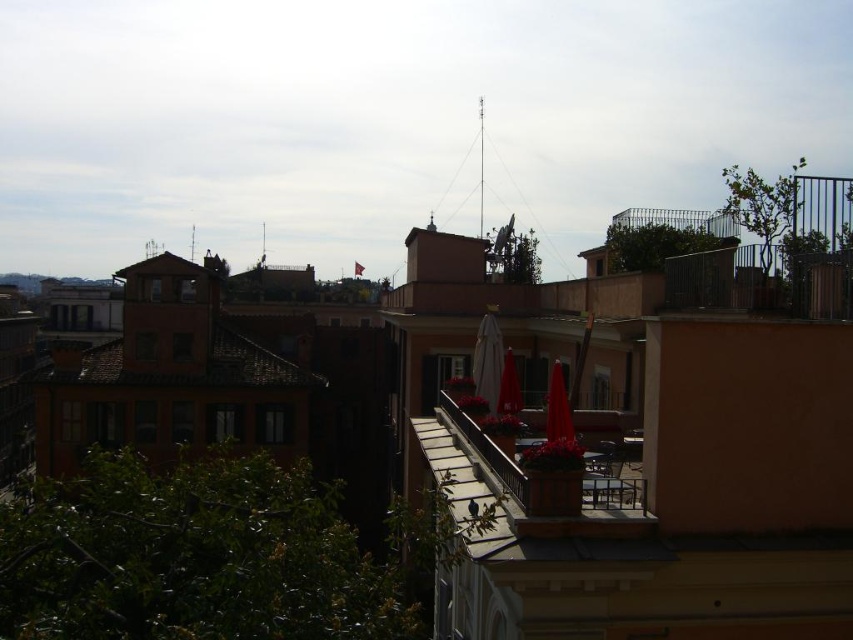
You are standing on the rooftop terrace and want to place a new potted plant to the right of the red matte umbrella at center. Where should you place it relative to the terracotta pot at center?

The terracotta pot at center is on the left side of the red matte umbrella at center, so placing the new potted plant to the right of the red matte umbrella at center would place it to the right of the terracotta pot at center.

You are standing on the rooftop terrace and want to place a new flower pot exactly at the center of the terrace. However, there is already a terracotta pot at center. Where is the terracotta pot located relative to the center of the terrace?

The terracotta pot at center is located exactly at the center of the terrace since its coordinates are given as point (552, 483), which corresponds to the center point.

You are a delivery drone that is 1.5 meters wide. You need to fly between the white matte umbrella at center and the red matte umbrella at center to deliver a package. Can you fit through the space between them?

The distance between the white matte umbrella at center and red matte umbrella at center is 3.14 meters. Since the drone is 1.5 meters wide, it can fit through the space between them as the distance is wider than the drone.